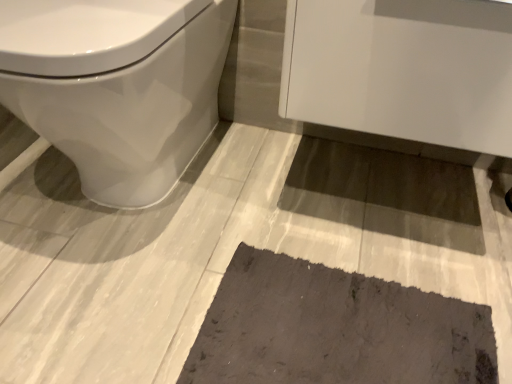
What are the coordinates of `vacant region above dark gray textured bath mat at lower center (from a real-world perspective)` in the screenshot? It's located at (338, 325).